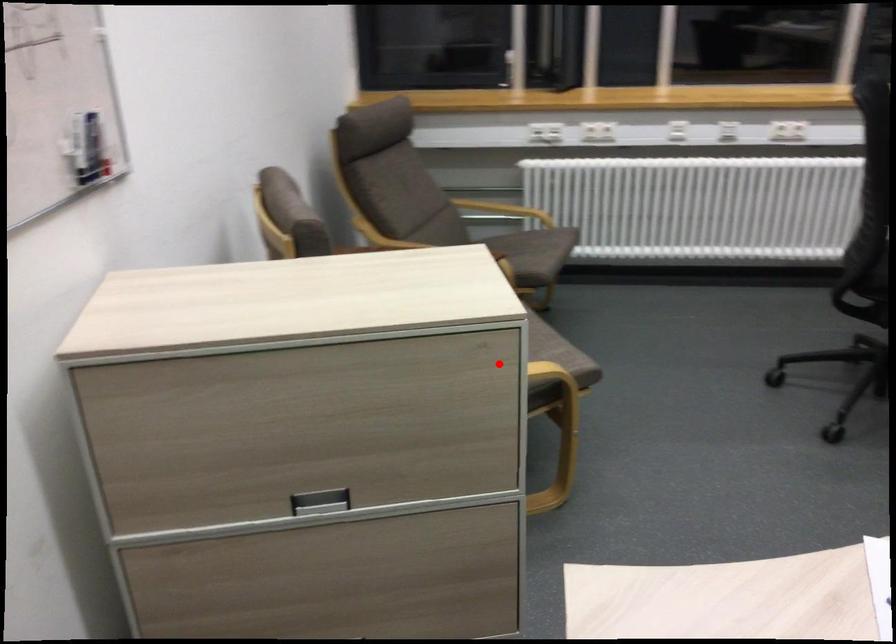
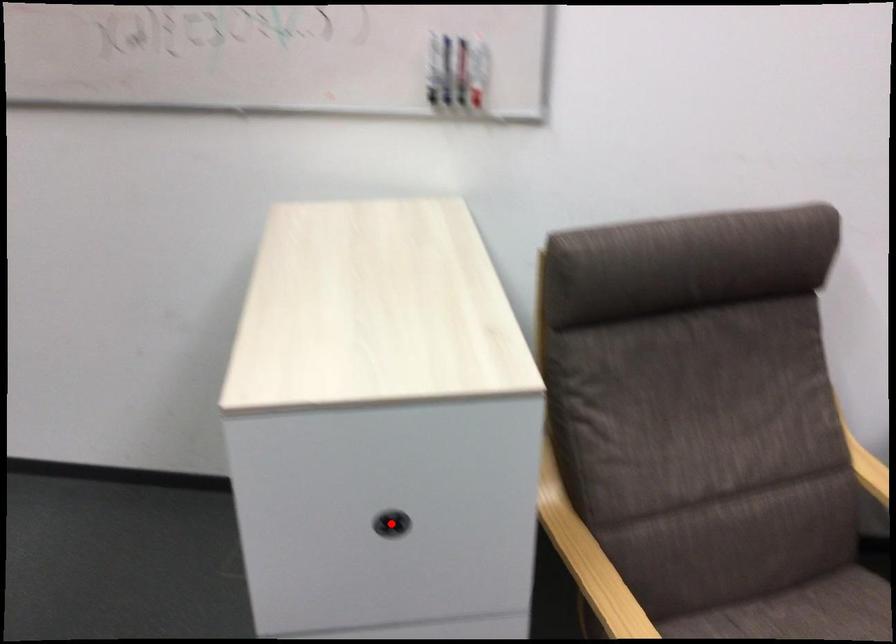
I am providing you with two images of the same scene from different viewpoints. A red point is marked on the first image and another point is marked on the second image. Do the highlighted points in image1 and image2 indicate the same real-world spot?

Yes